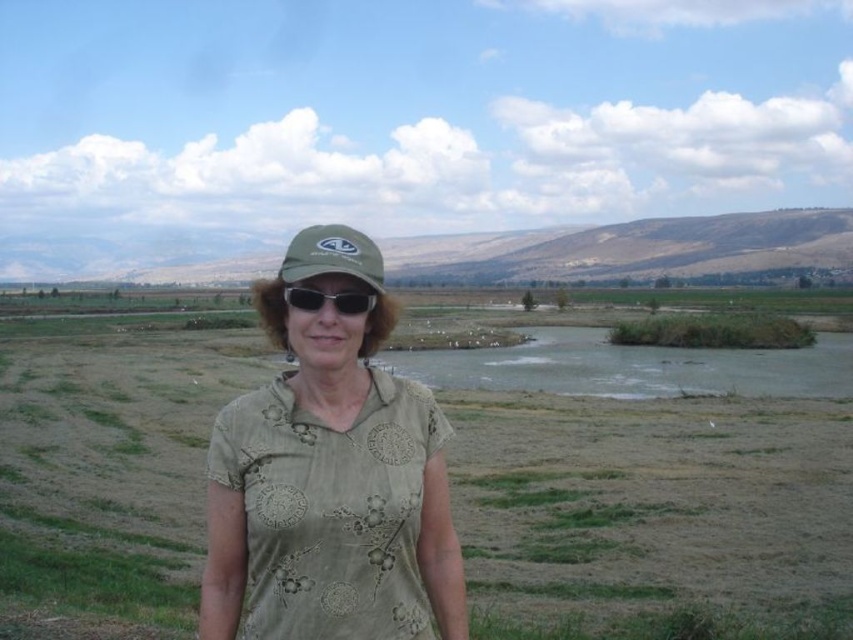
You are a photographer trying to capture a portrait of the person in the scene. You want to ensure that both the green fabric shirt at center and the black matte sunglasses at center are clearly visible in the photo. Given their positions, which object should you focus on first to ensure both are in focus?

The green fabric shirt at center is much taller than the black matte sunglasses at center. To ensure both are in focus, you should focus on the green fabric shirt at center first since it is farther away and occupies more space in the frame, allowing the depth of field to cover the closer sunglasses.

You are a photographer trying to capture the person in the scene. Since both the green fabric shirt at center and the green fabric baseball cap at center are in the frame, which one appears larger in your photo?

The green fabric shirt at center appears larger in the photo because it is closer to the viewer than the green fabric baseball cap at center.